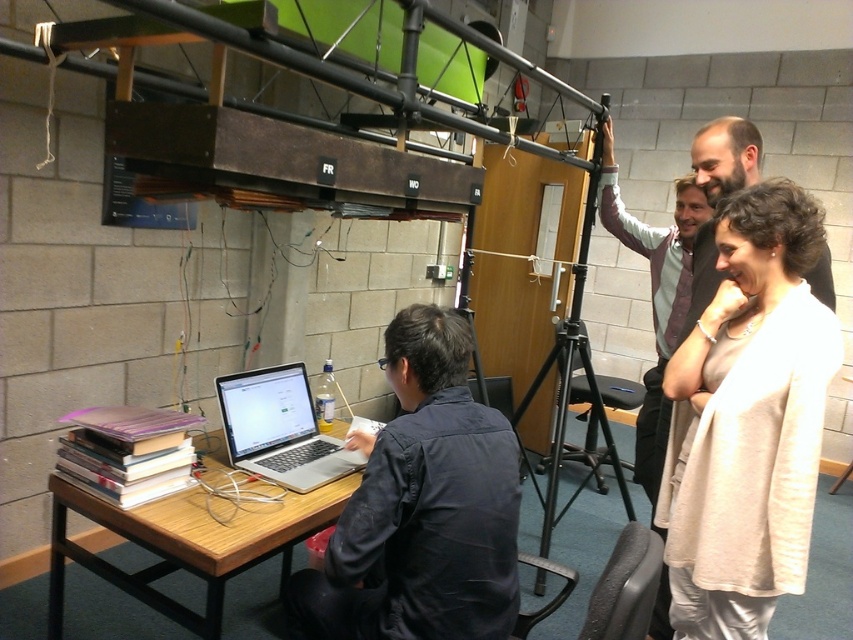
You are standing in the workshop and need to locate the wooden table at lower left. Which direction should you move relative to the dark blue shirt at center?

You should move to the left of the dark blue shirt at center to reach the wooden table at lower left.

You are a delivery robot with a package that needs to be placed on the wooden table at lower left. You are currently positioned near the black metal tripod at center. Can you move directly to the table without needing to adjust your path?

The wooden table at lower left and black metal tripod at center are 1.56 meters apart from each other. Since the distance is sufficient, the delivery robot can move directly to the wooden table at lower left without needing to adjust its path.

You are standing in the workshop and need to determine the relative sizes of the dark blue shirt at center and the wooden table at lower left. Which object is larger?

The wooden table at lower left is larger than the dark blue shirt at center.